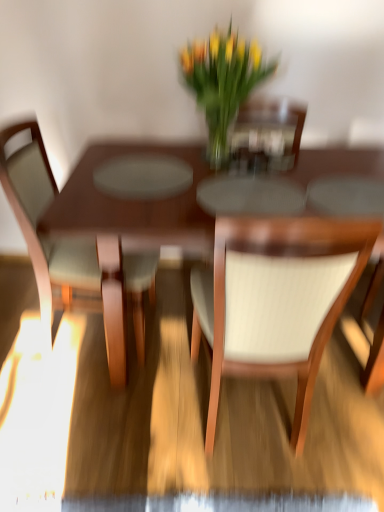
Identify the location of vacant space that's between light brown wood chair at left, the second chair from the right, and wooden table at center. (56, 370).